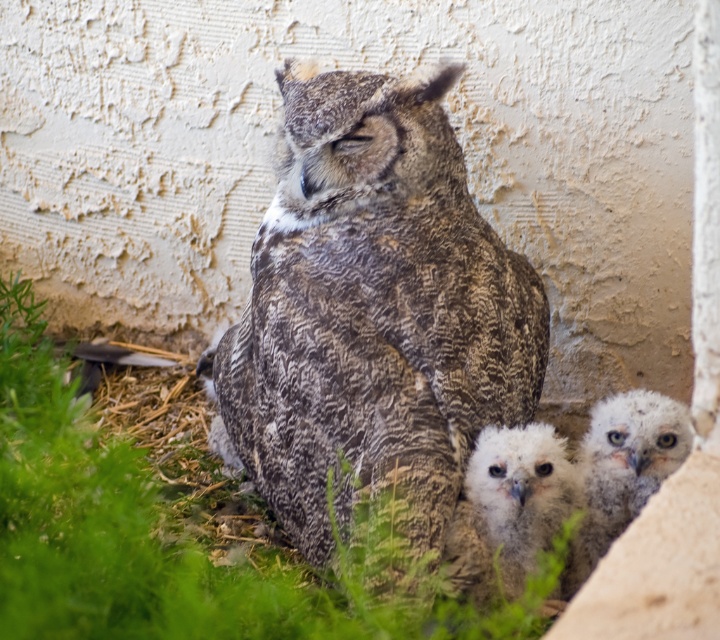
You are a birdwatcher observing the speckled feathered owl at center and the fluffy white owl at lower center. Which one is taller?

The speckled feathered owl at center is taller than the fluffy white owl at lower center according to the description.